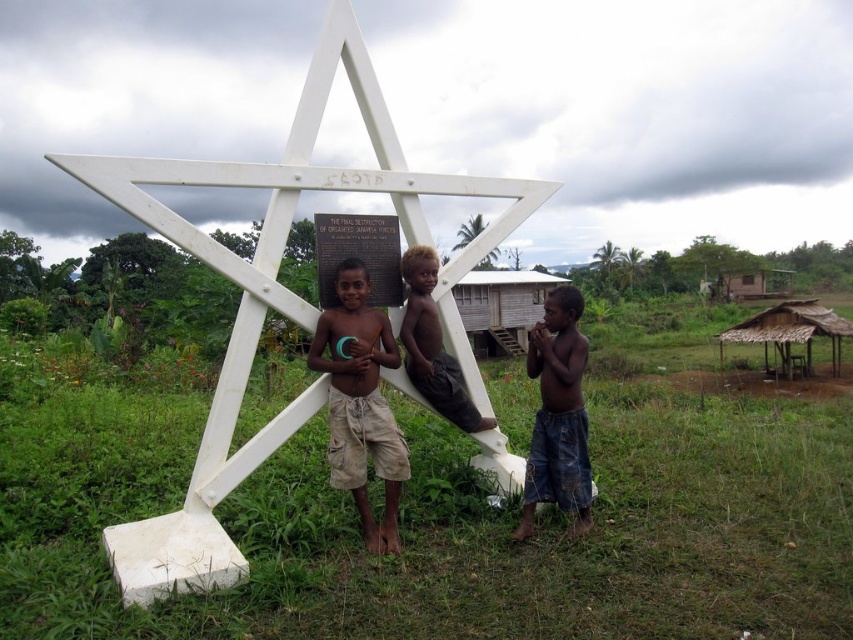
You are a photographer trying to capture both the thatched straw hut at lower right and the brown wooden hut at right in a single frame. Based on their heights, which one will appear smaller in the photo?

The thatched straw hut at lower right will appear smaller in the photo because it has a lesser height compared to the brown wooden hut at right.

You are a photographer planning to take a wide shot of the white matte star at center and the thatched straw hut at lower right. Given that your camera can capture a maximum distance of 25 meters between the two objects in the frame, will you be able to include both in a single shot?

The white matte star at center and thatched straw hut at lower right are 25.53 meters apart. Since the maximum distance your camera can capture is 25 meters, you will not be able to include both in a single shot.

From the picture: You are a tourist visiting this historical site. You see the white matte star at center and the thatched straw hut at lower right. Which object is positioned higher in the image?

The white matte star at center is located above the thatched straw hut at lower right, so it is positioned higher in the image.